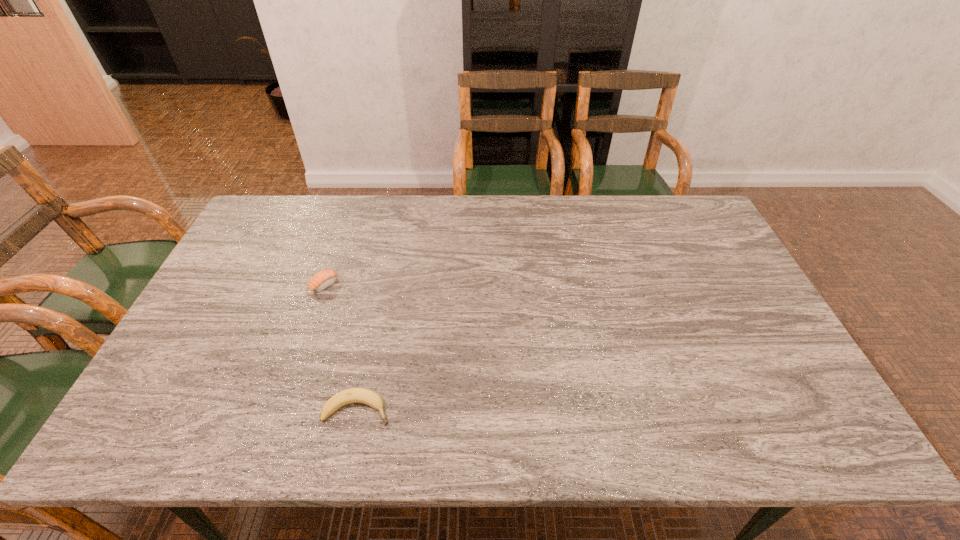
Identify the location of vacant space at the right edge of the desktop. pyautogui.click(x=764, y=358).

Identify the location of free location at the far left corner of the desktop. The height and width of the screenshot is (540, 960). (289, 207).